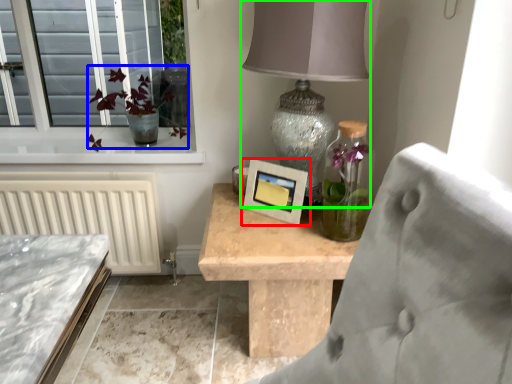
Question: Which object is positioned closest to picture frame (highlighted by a red box)? Select from floral arrangement (highlighted by a blue box) and table lamp (highlighted by a green box).

Choices:
 (A) floral arrangement
 (B) table lamp

Answer: (B)